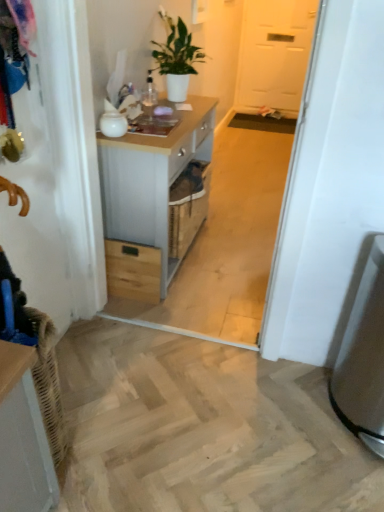
Question: Based on their sizes in the image, would you say white matte door at upper center is bigger or smaller than satin silver trash can at lower right?

Choices:
 (A) big
 (B) small

Answer: (A)

Question: Considering the positions of point (286, 57) and point (372, 248), is point (286, 57) closer or farther from the camera than point (372, 248)?

Choices:
 (A) closer
 (B) farther

Answer: (B)

Question: Based on their relative distances, which object is farther from the satin silver trash can at lower right?

Choices:
 (A) white matte door at upper center
 (B) white wood chest of drawers at center
 (C) white matte plant at upper center
 (D) wooden drawer at center

Answer: (A)

Question: Based on their relative distances, which object is farther from the satin silver trash can at lower right?

Choices:
 (A) white wood chest of drawers at center
 (B) wooden drawer at center
 (C) white matte plant at upper center
 (D) white matte door at upper center

Answer: (D)